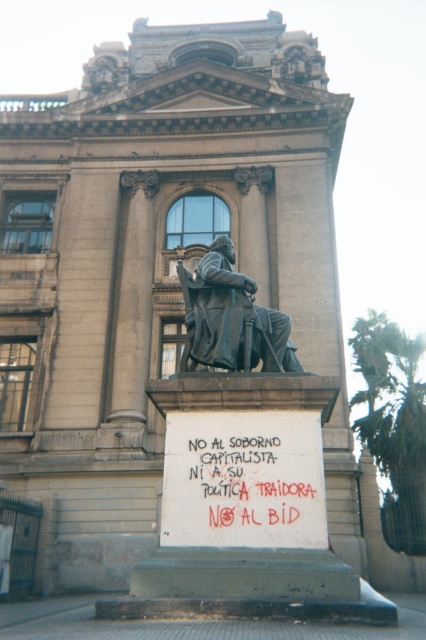
What are the coordinates of the red graffiti at center?

The red graffiti at center is located at point (255, 483).

You are a tour guide explaining the scene to visitors. Pointing to the red graffiti at center and the green leafy palm tree at right, you want to clarify their positions. Which object is closer to the viewer?

The red graffiti at center is closer to the viewer than the green leafy palm tree at right because it is positioned in front of it.

You are a tour guide explaining the historical site to a group. You point out the red graffiti at center and the bronze statue at center. Which object is located lower in the scene?

The red graffiti at center is positioned under the bronze statue at center, so it is located lower in the scene.